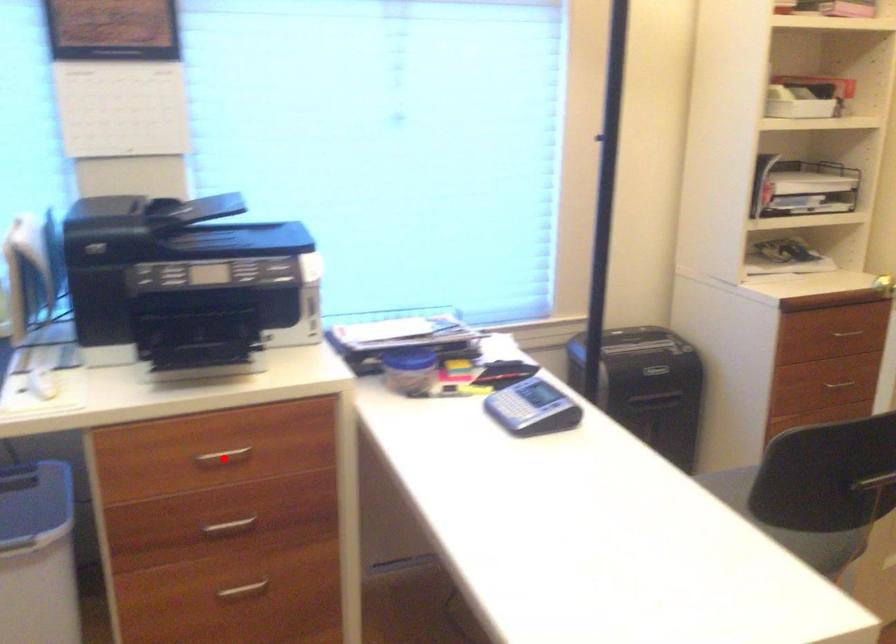
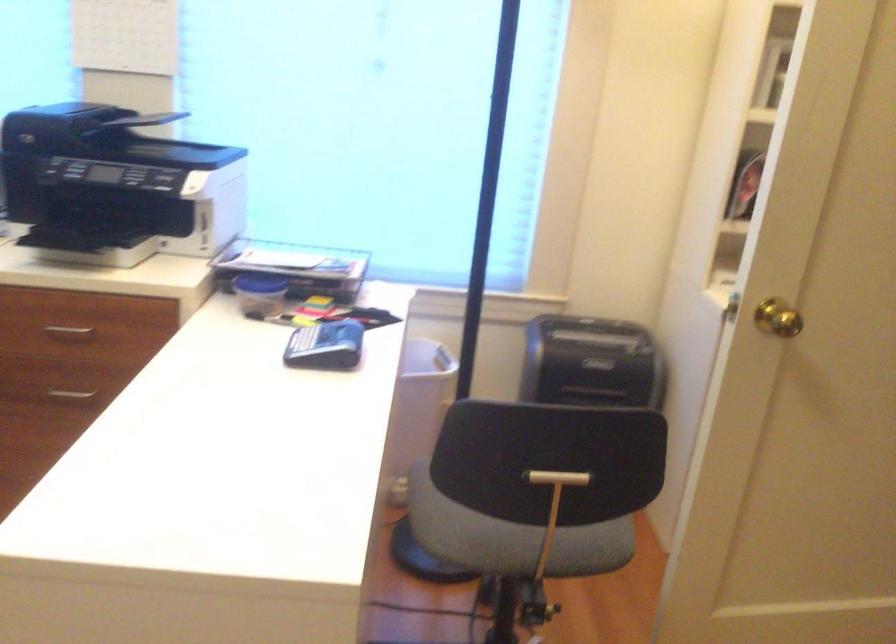
Locate, in the second image, the point that corresponds to the highlighted location in the first image.

(69, 332)